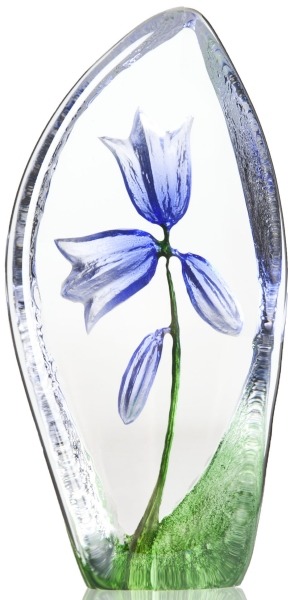
You are a GUI agent. You are given a task and a screenshot of the screen. Output one action in this format:
    pyautogui.click(x=<x>, y=<y>)
    Task: Click on the base of flower
    
    Given the screenshot: What is the action you would take?
    pyautogui.click(x=148, y=543)